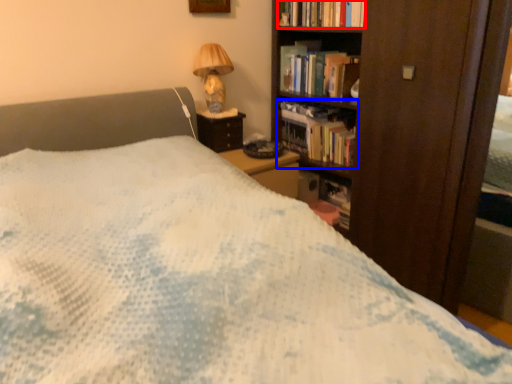
Question: Which of the following is the farthest to the observer, book (highlighted by a red box) or book (highlighted by a blue box)?

Choices:
 (A) book
 (B) book

Answer: (B)